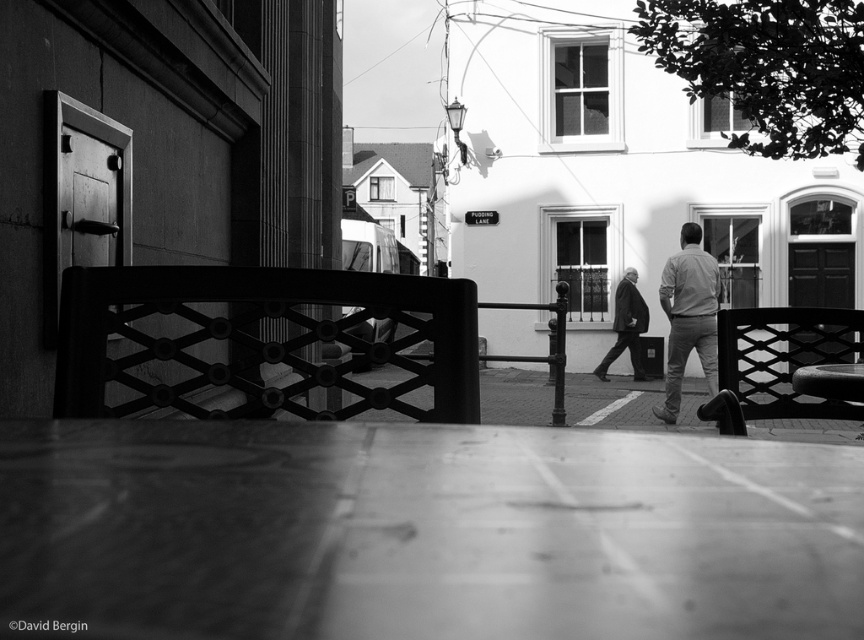
Question: Which point is closer to the camera?

Choices:
 (A) smooth wood bench at center
 (B) light gray shirt at center
 (C) smooth concrete pavement at center

Answer: (C)

Question: Does smooth wood bench at center have a smaller size compared to dark suit at center?

Choices:
 (A) yes
 (B) no

Answer: (B)

Question: Is smooth wood bench at center bigger than light gray shirt at center?

Choices:
 (A) no
 (B) yes

Answer: (B)

Question: Among these objects, which one is farthest from the camera?

Choices:
 (A) smooth wood bench at center
 (B) dark suit at center
 (C) smooth concrete pavement at center

Answer: (B)

Question: Does light gray shirt at center have a greater width compared to dark suit at center?

Choices:
 (A) no
 (B) yes

Answer: (A)

Question: Which of the following is the farthest from the observer?

Choices:
 (A) dark suit at center
 (B) smooth concrete pavement at center

Answer: (A)